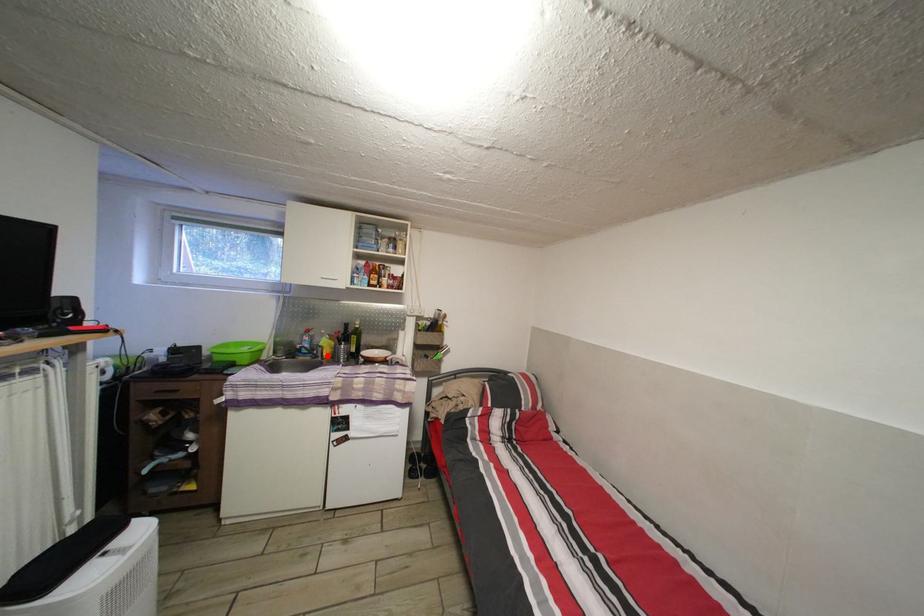
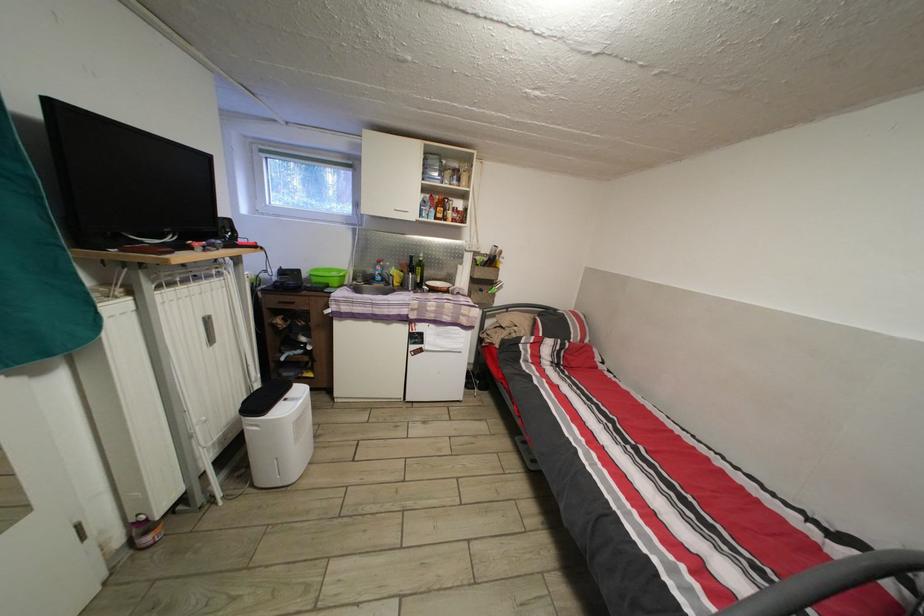
Question: I am providing you with two images of the same scene from different viewpoints. A red point is shown in image1. For the corresponding object point in image2, is it positioned nearer or farther from the camera?

Choices:
 (A) Nearer
 (B) Farther

Answer: (A)